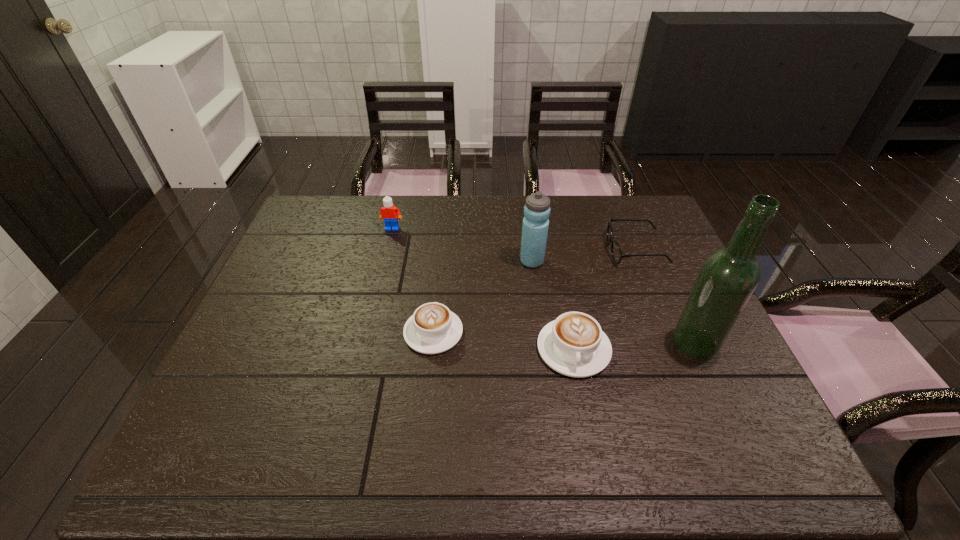
Find the location of a particular element. This screenshot has width=960, height=540. free space that satisfies the following two spatial constraints: 1. on the face of the liquor; 2. on the right side of the leftmost object is located at coordinates (365, 343).